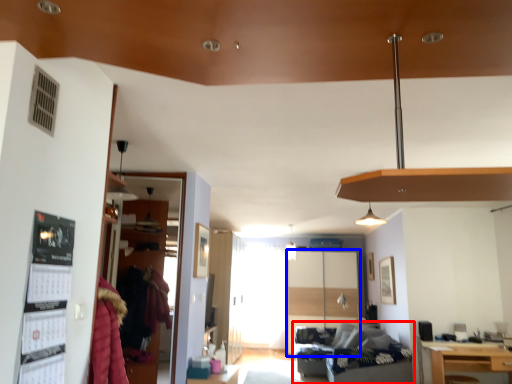
Question: Which point is closer to the camera, studio couch (highlighted by a red box) or glass door (highlighted by a blue box)?

Choices:
 (A) studio couch
 (B) glass door

Answer: (A)